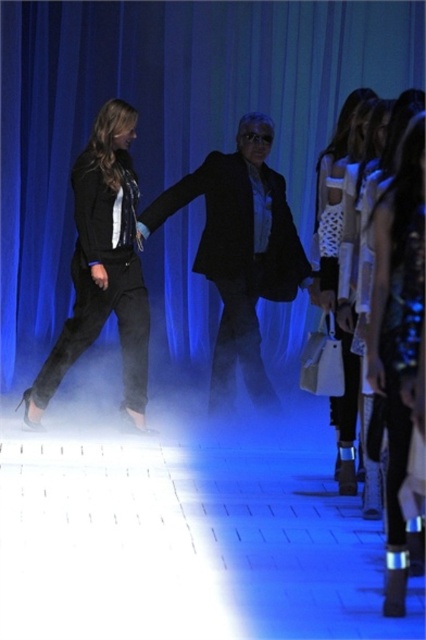
Is metallic silver boots at lower right wider than white textured sweater at center?

No, metallic silver boots at lower right is not wider than white textured sweater at center.

Can you confirm if metallic silver boots at lower right is positioned below white textured sweater at center?

Yes.

Between point (423, 186) and point (345, 376), which one is positioned behind?

The point (345, 376) is behind.

This screenshot has height=640, width=426. Find the location of `metallic silver boots at lower right`. metallic silver boots at lower right is located at coordinates (396, 336).

Can you confirm if matte black suit at center is thinner than metallic silver boots at lower right?

Incorrect, matte black suit at center's width is not less than metallic silver boots at lower right's.

Measure the distance between point (265, 122) and camera.

A distance of 15.67 feet exists between point (265, 122) and camera.

Where is `matte black suit at center`? matte black suit at center is located at coordinates (239, 250).

What are the coordinates of `matte black suit at center` in the screenshot? It's located at (239, 250).

Can you confirm if matte black suit at center is positioned to the left of black matte blazer at left?

In fact, matte black suit at center is to the right of black matte blazer at left.

Based on the photo, can you confirm if matte black suit at center is bigger than black matte blazer at left?

Yes, matte black suit at center is bigger than black matte blazer at left.

Which is in front, point (232, 323) or point (72, 337)?

Point (72, 337) is more forward.

Locate an element on the screen. The height and width of the screenshot is (640, 426). matte black suit at center is located at coordinates (239, 250).